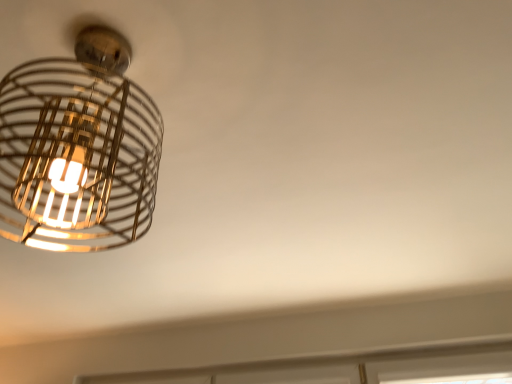
The width and height of the screenshot is (512, 384). I want to click on gold wire cage at upper left, so click(x=78, y=149).

This screenshot has height=384, width=512. What do you see at coordinates (78, 149) in the screenshot?
I see `gold wire cage at upper left` at bounding box center [78, 149].

Measure the distance between gold wire cage at upper left and camera.

The distance of gold wire cage at upper left from camera is 27.33 inches.

Where is `gold wire cage at upper left`? gold wire cage at upper left is located at coordinates (78, 149).